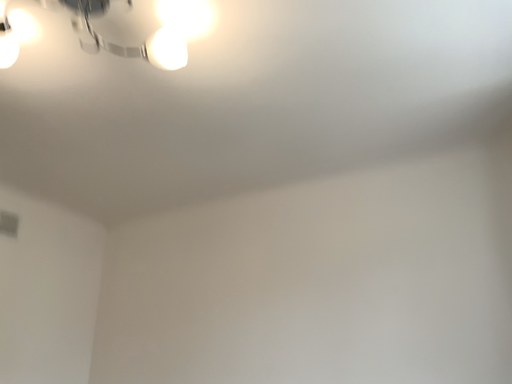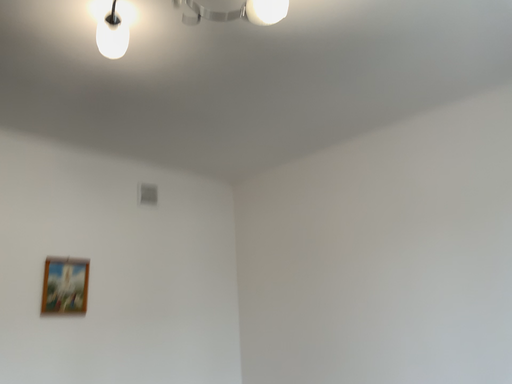
Question: How did the camera likely rotate when shooting the video?

Choices:
 (A) rotated downward
 (B) rotated upward

Answer: (A)